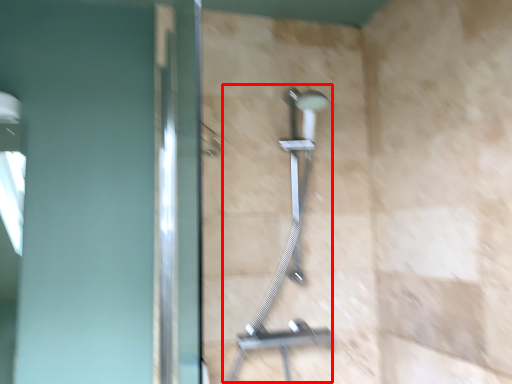
Question: In this image, where is shower (annotated by the red box) located relative to screen door?

Choices:
 (A) left
 (B) right

Answer: (B)